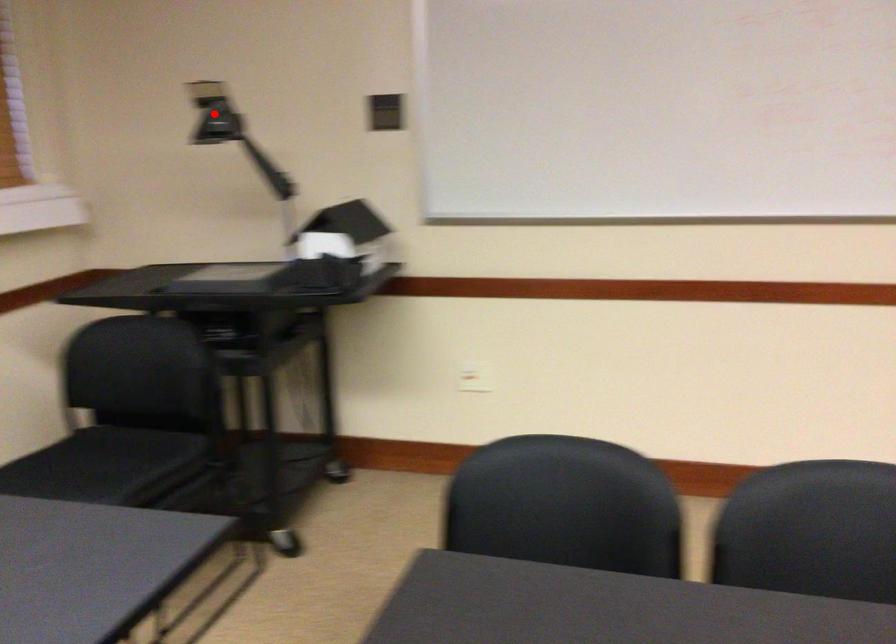
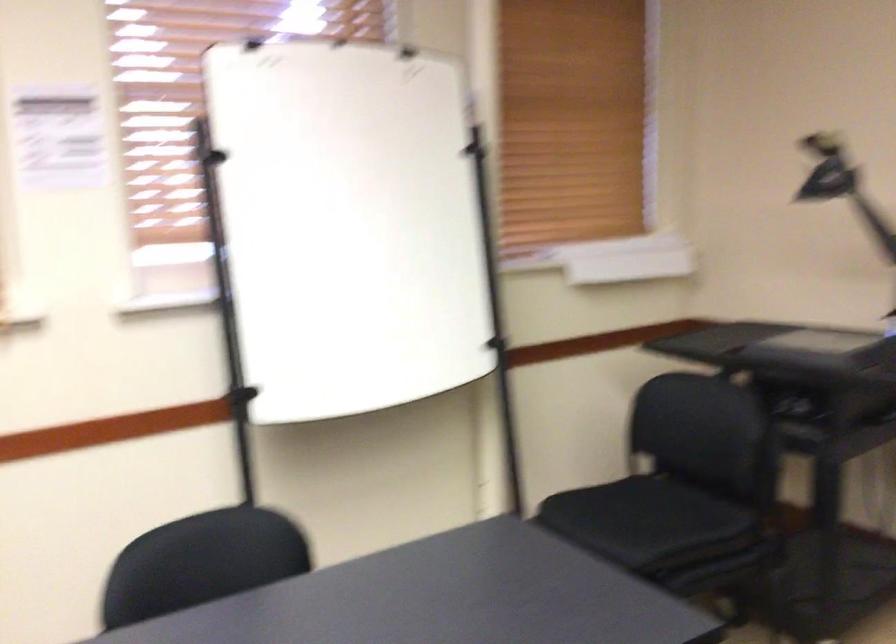
Question: I am providing you with two images of the same scene from different viewpoints. A red point is marked on the first image. Is the red point's position out of view in image 2?

Choices:
 (A) Yes
 (B) No

Answer: (A)